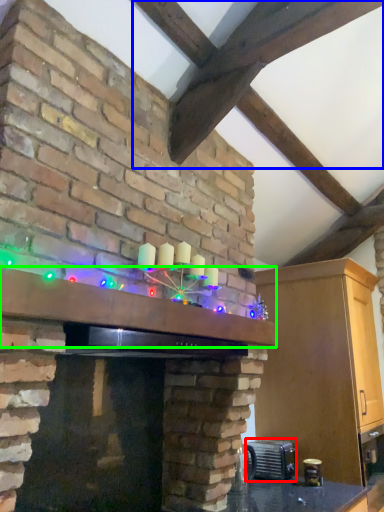
Question: Considering the real-world distances, which object is closest to appliance (highlighted by a red box)? exhaust hood (highlighted by a blue box) or mantle (highlighted by a green box).

Choices:
 (A) exhaust hood
 (B) mantle

Answer: (B)